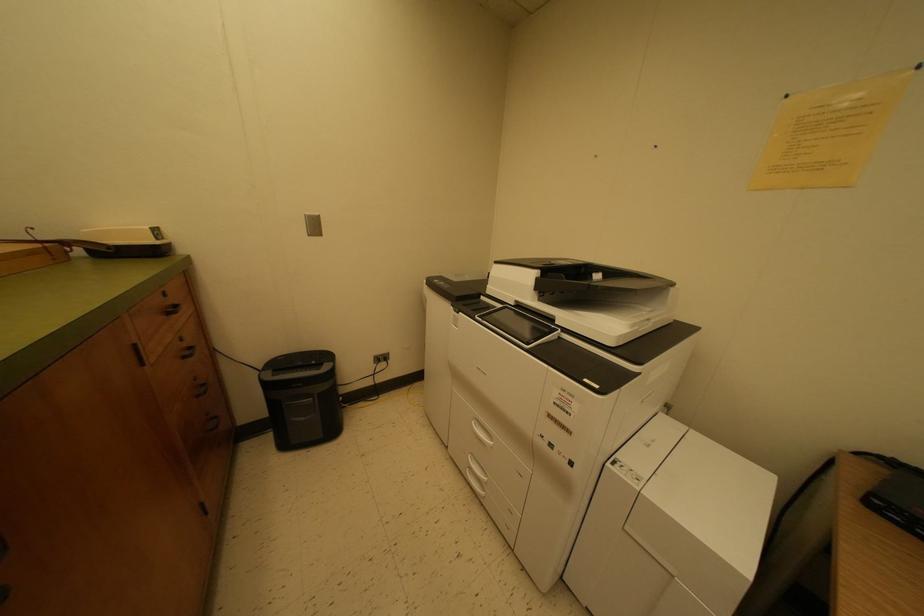
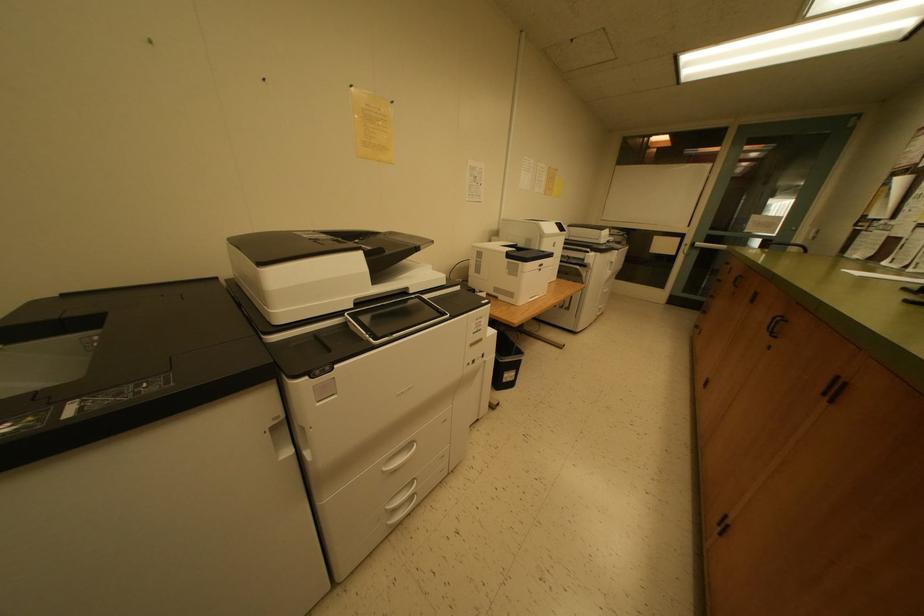
The first image is from the beginning of the video and the second image is from the end. How did the camera likely rotate when shooting the video?

The camera's rotation is toward right-down.